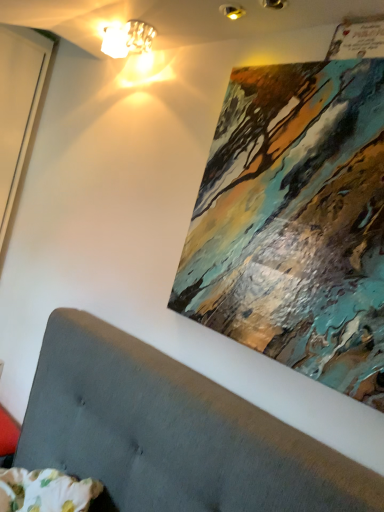
Question: Considering the positions of abstract painting at upper right and matte glass lampshade at upper center in the image, is abstract painting at upper right taller or shorter than matte glass lampshade at upper center?

Choices:
 (A) tall
 (B) short

Answer: (A)

Question: Choose the correct answer: Is abstract painting at upper right inside matte glass lampshade at upper center or outside it?

Choices:
 (A) outside
 (B) inside

Answer: (A)

Question: Is point (359, 207) closer or farther from the camera than point (119, 34)?

Choices:
 (A) farther
 (B) closer

Answer: (B)

Question: Does point (152, 32) appear closer or farther from the camera than point (359, 282)?

Choices:
 (A) closer
 (B) farther

Answer: (B)

Question: In terms of width, does matte glass lampshade at upper center look wider or thinner when compared to abstract painting at upper right?

Choices:
 (A) wide
 (B) thin

Answer: (A)

Question: From the image's perspective, is matte glass lampshade at upper center above or below abstract painting at upper right?

Choices:
 (A) above
 (B) below

Answer: (A)

Question: Visually, is matte glass lampshade at upper center positioned to the left or to the right of abstract painting at upper right?

Choices:
 (A) left
 (B) right

Answer: (A)